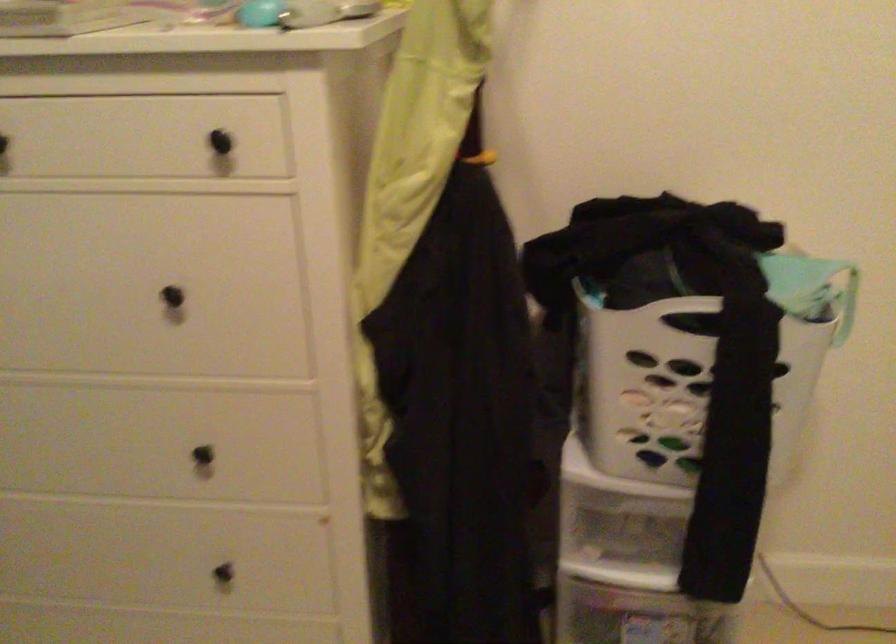
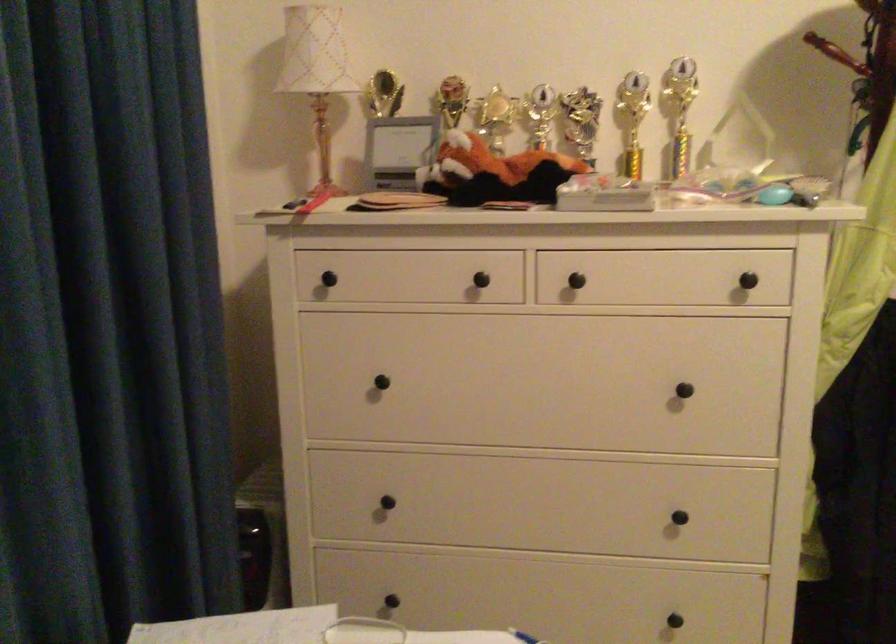
Question: How did the camera likely rotate?

Choices:
 (A) Left
 (B) Right
 (C) Up
 (D) Down

Answer: (C)